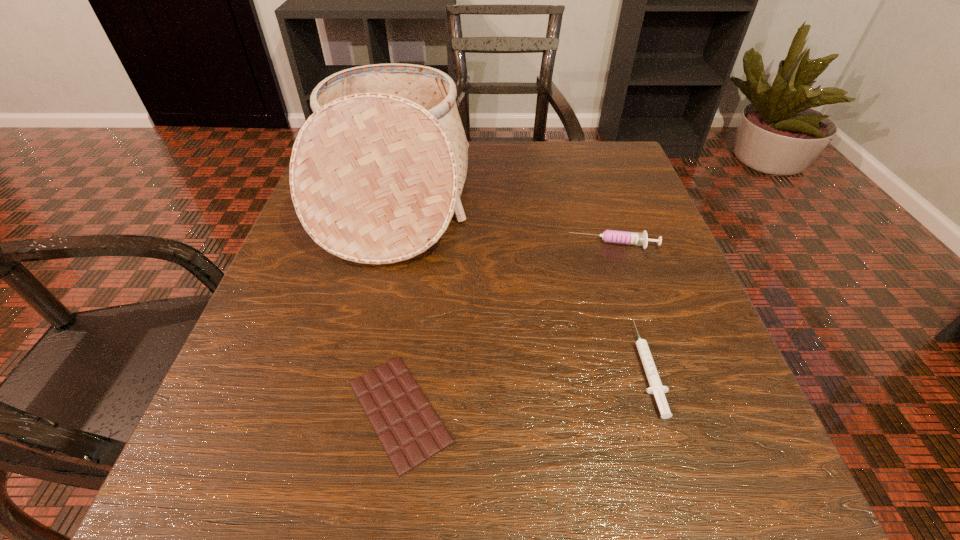
At what (x,y) coordinates should I click in order to perform the action: click on object situated at the far edge. Please return your answer as a coordinate pair (x, y). Looking at the image, I should click on (376, 174).

Locate an element on the screen. The width and height of the screenshot is (960, 540). object that is at the near edge is located at coordinates (411, 432).

The width and height of the screenshot is (960, 540). Find the location of `object at the left edge`. object at the left edge is located at coordinates (376, 174).

Where is `object that is positioned at the far left corner`? object that is positioned at the far left corner is located at coordinates (376, 174).

The width and height of the screenshot is (960, 540). What are the coordinates of `free space at the far edge of the desktop` in the screenshot? It's located at (544, 164).

What are the coordinates of `vacant area at the near edge` in the screenshot? It's located at (320, 511).

I want to click on vacant region at the left edge of the desktop, so click(271, 362).

Identify the location of free region at the right edge of the desktop. (636, 338).

Locate an element on the screen. This screenshot has width=960, height=540. free location at the near left corner is located at coordinates (301, 471).

In the image, there is a desktop. Where is `vacant space at the far right corner`? vacant space at the far right corner is located at coordinates (590, 150).